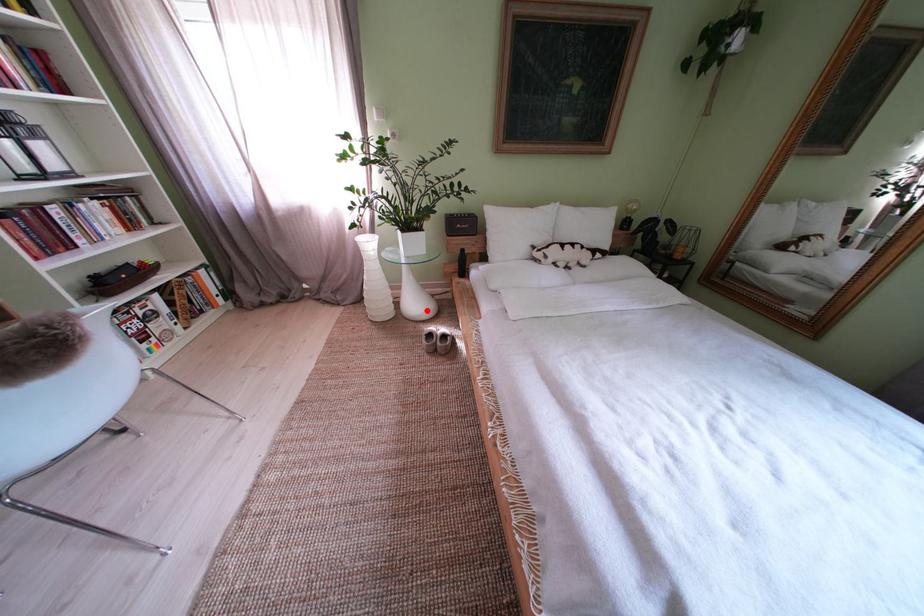
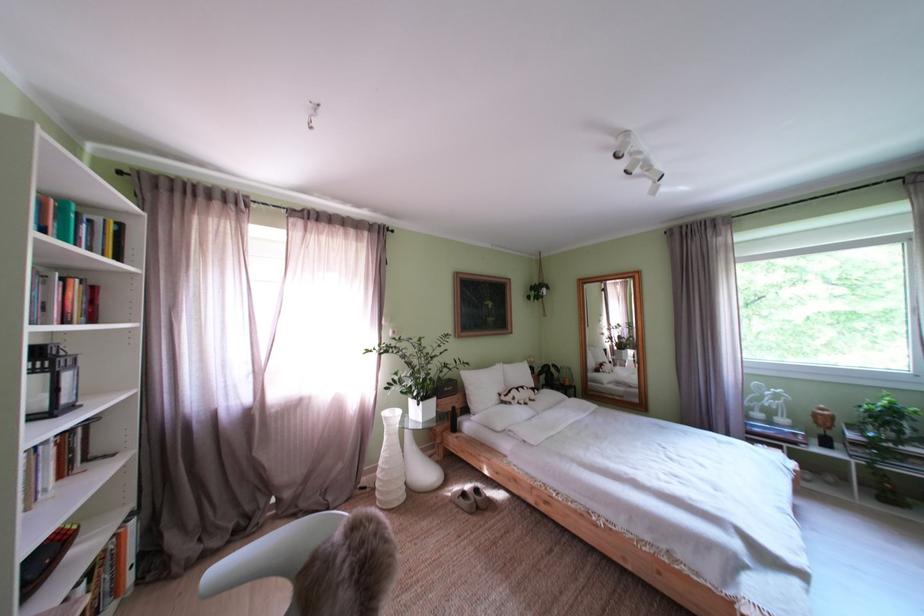
Locate, in the second image, the point that corresponds to the highlighted location in the first image.

(438, 479)